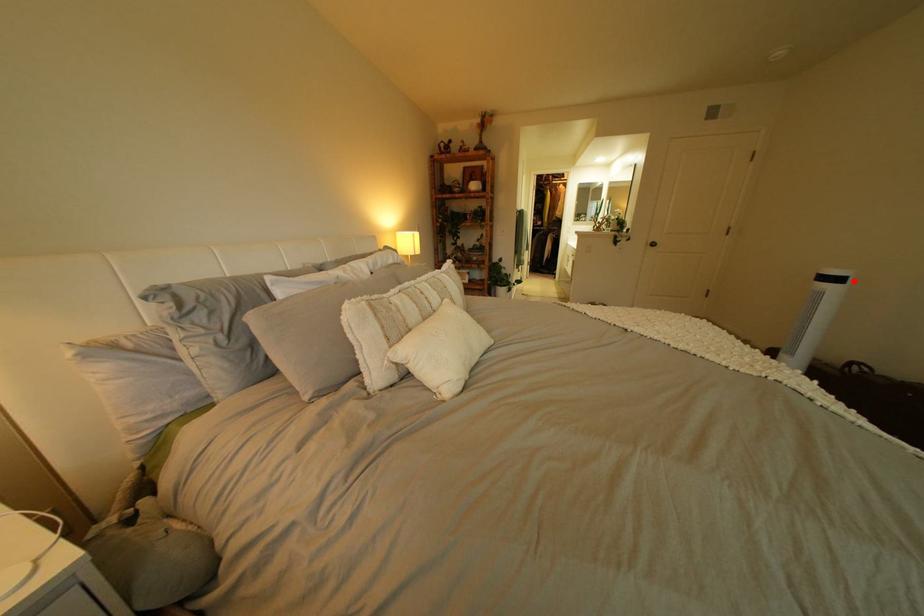
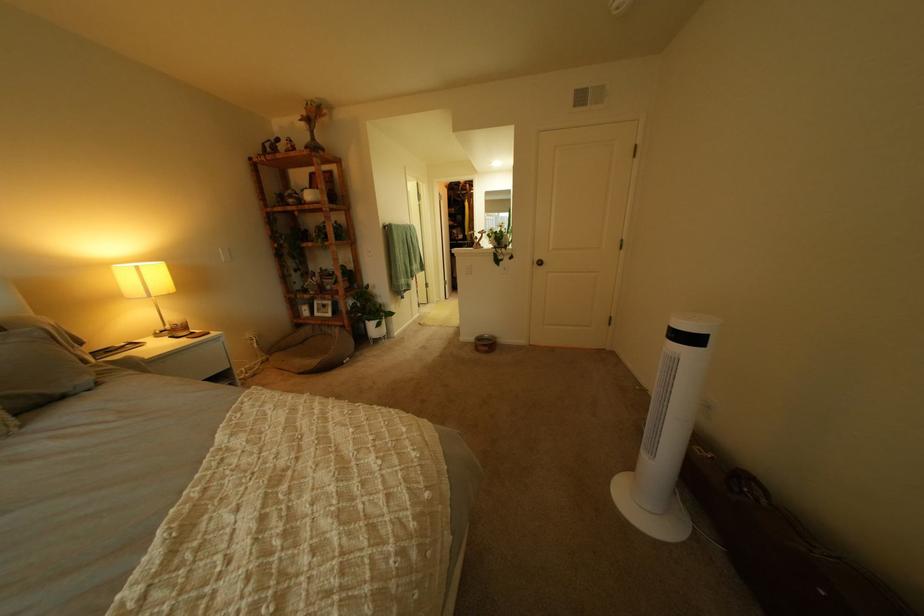
Find the pixel in the second image that matches the highlighted location in the first image.

(710, 341)